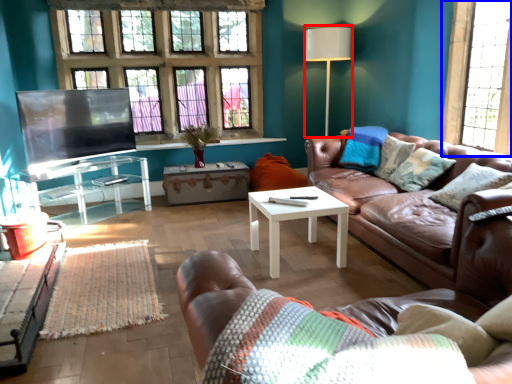
Question: Which point is further to the camera, lamp (highlighted by a red box) or window (highlighted by a blue box)?

Choices:
 (A) lamp
 (B) window

Answer: (A)